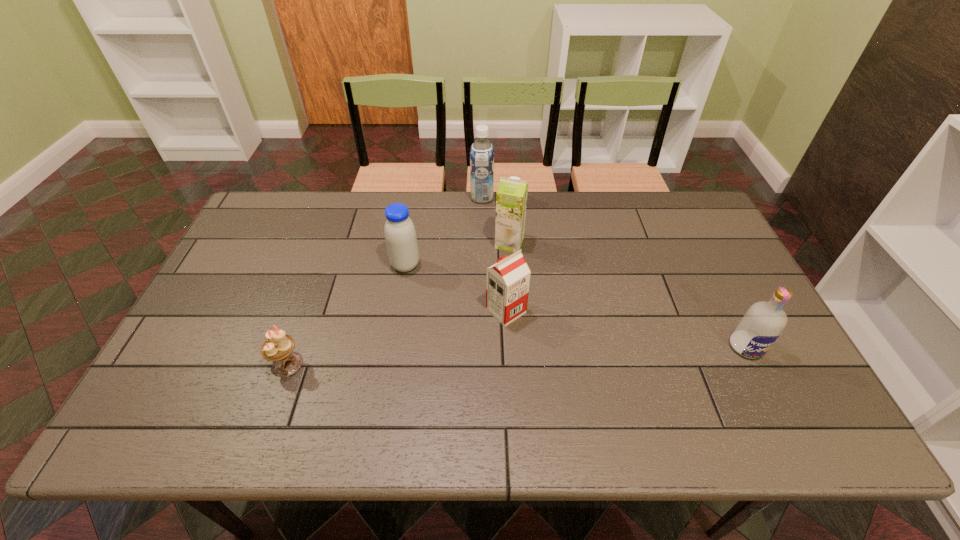
Where is `vacant space that satisfies the following two spatial constraints: 1. on the label of the second farthest soya milk; 2. on the left side of the farthest soya milk`? The width and height of the screenshot is (960, 540). vacant space that satisfies the following two spatial constraints: 1. on the label of the second farthest soya milk; 2. on the left side of the farthest soya milk is located at coordinates (482, 243).